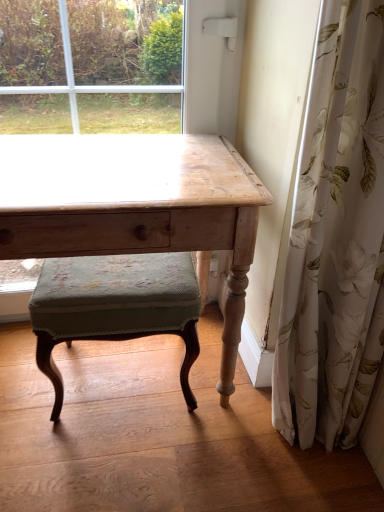
Find the location of a particular element. free location in front of white floral fabric at right is located at coordinates (313, 481).